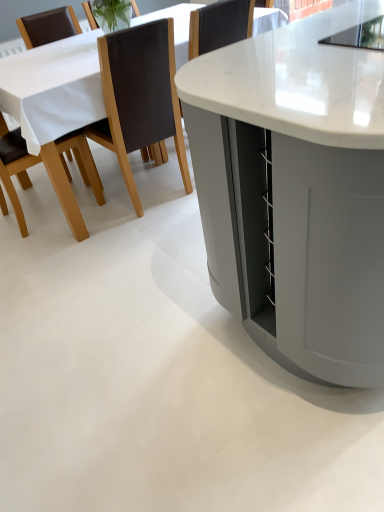
Image resolution: width=384 pixels, height=512 pixels. I want to click on vacant area that is in front of brown leather chair at upper left, which is the 1th chair from right to left, so click(142, 246).